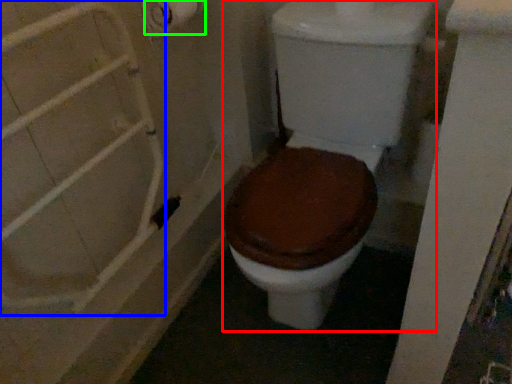
Question: Estimate the real-world distances between objects in this image. Which object is farther from toilet (highlighted by a red box), shower door (highlighted by a blue box) or toilet paper (highlighted by a green box)?

Choices:
 (A) shower door
 (B) toilet paper

Answer: (B)